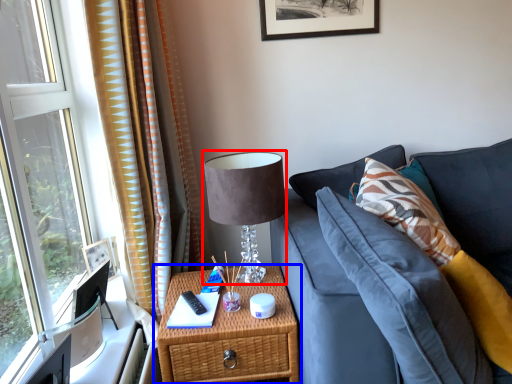
Question: Which of the following is the farthest to the observer, table lamp (highlighted by a red box) or nightstand (highlighted by a blue box)?

Choices:
 (A) table lamp
 (B) nightstand

Answer: (A)